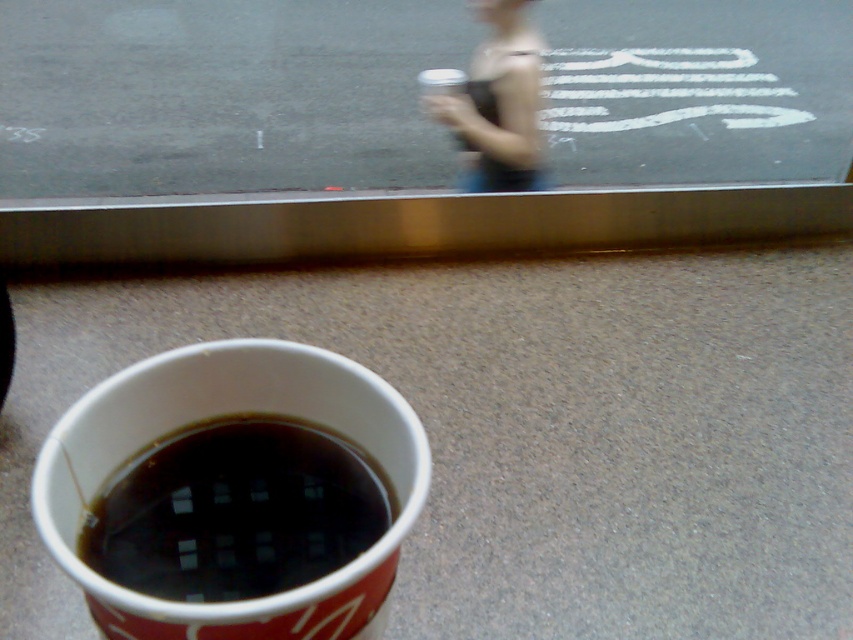
Question: From the image, what is the correct spatial relationship of black paper cup at lower left in relation to matte black tank top at upper center?

Choices:
 (A) below
 (B) above

Answer: (A)

Question: Which point appears farthest from the camera in this image?

Choices:
 (A) (180, 534)
 (B) (531, 36)

Answer: (B)

Question: Can you confirm if black paper cup at lower left is wider than matte black tank top at upper center?

Choices:
 (A) yes
 (B) no

Answer: (B)

Question: Does black paper cup at lower left come behind matte black tank top at upper center?

Choices:
 (A) no
 (B) yes

Answer: (A)

Question: Which point appears farthest from the camera in this image?

Choices:
 (A) (514, 4)
 (B) (247, 419)

Answer: (A)